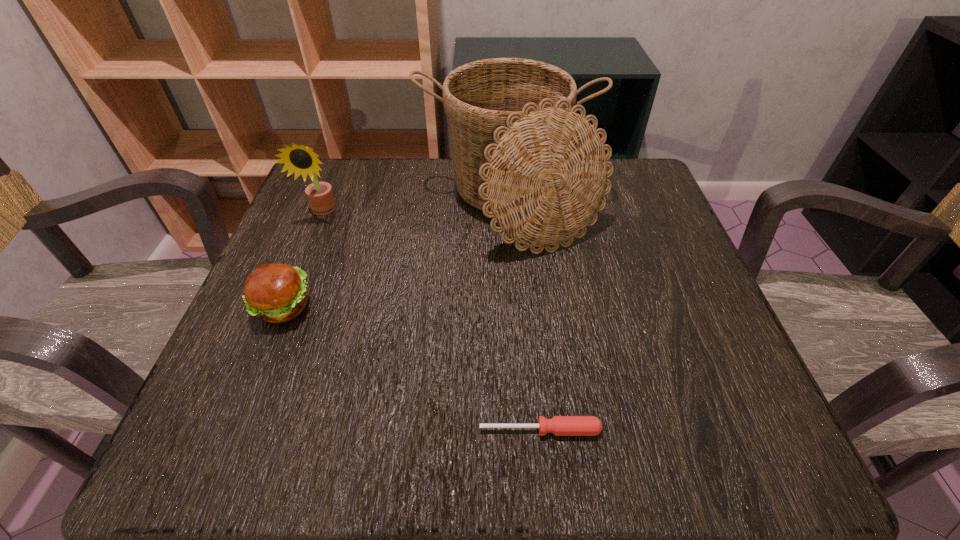
Identify the location of basket that is at the far edge. Image resolution: width=960 pixels, height=540 pixels. (521, 153).

Find the location of `sunflower that is at the far edge`. sunflower that is at the far edge is located at coordinates (302, 160).

At what (x,y) coordinates should I click in order to perform the action: click on object that is positioned at the near edge. Please return your answer as a coordinate pair (x, y). The image size is (960, 540). Looking at the image, I should click on (559, 425).

Image resolution: width=960 pixels, height=540 pixels. In order to click on sunflower positioned at the left edge in this screenshot , I will do `click(302, 160)`.

The image size is (960, 540). I want to click on hamburger that is positioned at the left edge, so click(276, 293).

The width and height of the screenshot is (960, 540). Find the location of `object located at the right edge`. object located at the right edge is located at coordinates (521, 153).

Locate an element on the screen. Image resolution: width=960 pixels, height=540 pixels. object located at the far left corner is located at coordinates (302, 160).

You are a GUI agent. You are given a task and a screenshot of the screen. Output one action in this format:
    pyautogui.click(x=<x>, y=<y>)
    Task: Click on the object that is at the far right corner
    This screenshot has width=960, height=540.
    Given the screenshot: What is the action you would take?
    pyautogui.click(x=521, y=153)

Find the location of a particular element. The width and height of the screenshot is (960, 540). free region at the far edge of the desktop is located at coordinates (385, 168).

Find the location of a particular element. This screenshot has height=540, width=960. vacant space at the near edge is located at coordinates (621, 446).